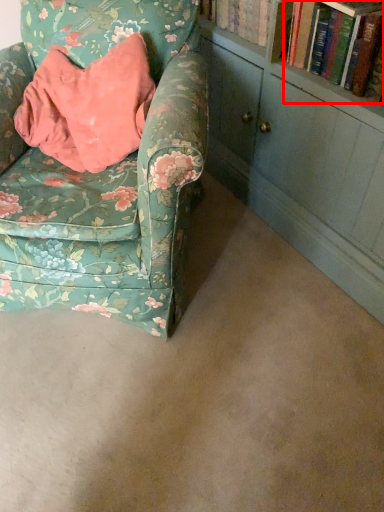
Question: Observing the image, what is the correct spatial positioning of book (annotated by the red box) in reference to chair?

Choices:
 (A) left
 (B) right

Answer: (B)